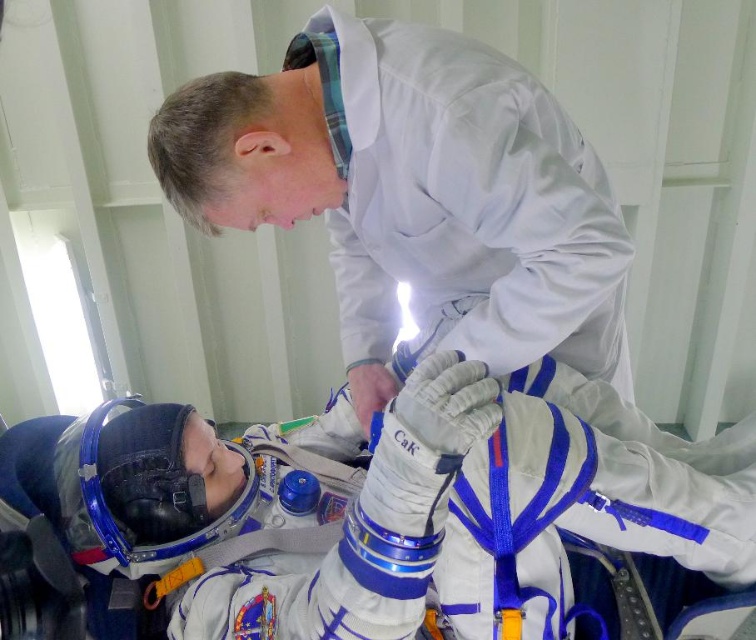
You are an astronaut preparing for a mission and need to quickly grab your equipment. You see the white fabric spacesuit at lower left and the white smooth lab coat at upper center. Can you reach both items without moving your position if your arms can extend 10 inches?

The white fabric spacesuit at lower left and white smooth lab coat at upper center are 10.72 inches apart. Since your arms can only extend 10 inches, you cannot reach both items without moving your position.

Based on the photo, you are an astronaut preparing for a mission and need to locate your equipment. You see a white fabric spacesuit at lower left and a white smooth lab coat at upper center. Which item is positioned lower in the scene?

The white fabric spacesuit at lower left is positioned below the white smooth lab coat at upper center, so it is lower in the scene.